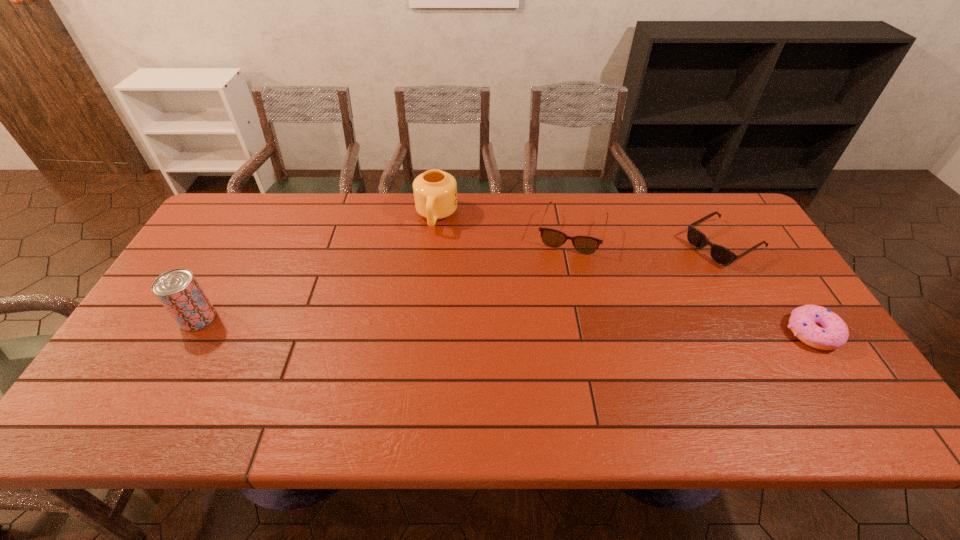
Locate an element on the screen. doughnut located in the right edge section of the desktop is located at coordinates (818, 327).

This screenshot has width=960, height=540. I want to click on sunglasses that is at the right edge, so click(x=721, y=255).

Find the location of a particular element. The height and width of the screenshot is (540, 960). object that is at the far right corner is located at coordinates (721, 255).

Locate an element on the screen. The width and height of the screenshot is (960, 540). vacant space at the far edge is located at coordinates (341, 202).

Where is `vacant area at the near edge`? vacant area at the near edge is located at coordinates (242, 373).

This screenshot has width=960, height=540. In order to click on free space at the right edge in this screenshot , I will do pyautogui.click(x=736, y=241).

This screenshot has width=960, height=540. In the image, there is a desktop. Find the location of `vacant area at the far left corner`. vacant area at the far left corner is located at coordinates (228, 210).

I want to click on blank area at the near left corner, so click(x=152, y=386).

Where is `free region at the far right corner`? This screenshot has width=960, height=540. free region at the far right corner is located at coordinates (704, 230).

At what (x,y) coordinates should I click in order to perform the action: click on vacant space that's between the sunglasses and the leftmost object. Please return your answer as a coordinate pair (x, y). Looking at the image, I should click on (461, 281).